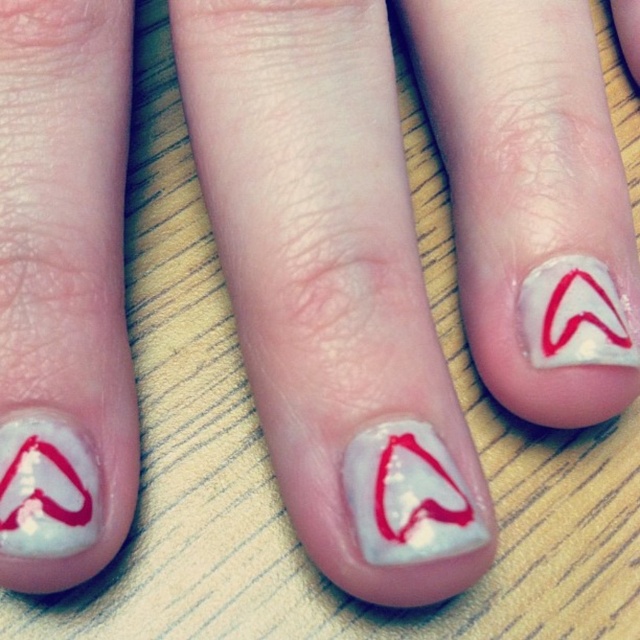
Question: Is white glossy heart at center bigger than white glossy heart at lower left?

Choices:
 (A) no
 (B) yes

Answer: (B)

Question: Which point appears closest to the camera in this image?

Choices:
 (A) (577, 276)
 (B) (16, 276)
 (C) (384, 477)

Answer: (C)

Question: Does white glossy heart at center appear on the right side of white glossy heart at lower left?

Choices:
 (A) yes
 (B) no

Answer: (A)

Question: Which point is farther from the camera taking this photo?

Choices:
 (A) (93, 492)
 (B) (561, 298)

Answer: (B)

Question: Which object is positioned closest to the white glossy heart at upper right?

Choices:
 (A) white glossy heart at lower left
 (B) white glossy nail at center
 (C) white glossy heart at center
 (D) white glossy nail art at center

Answer: (C)

Question: In this image, where is white glossy nail art at center located relative to white glossy nail at center?

Choices:
 (A) above
 (B) below

Answer: (A)